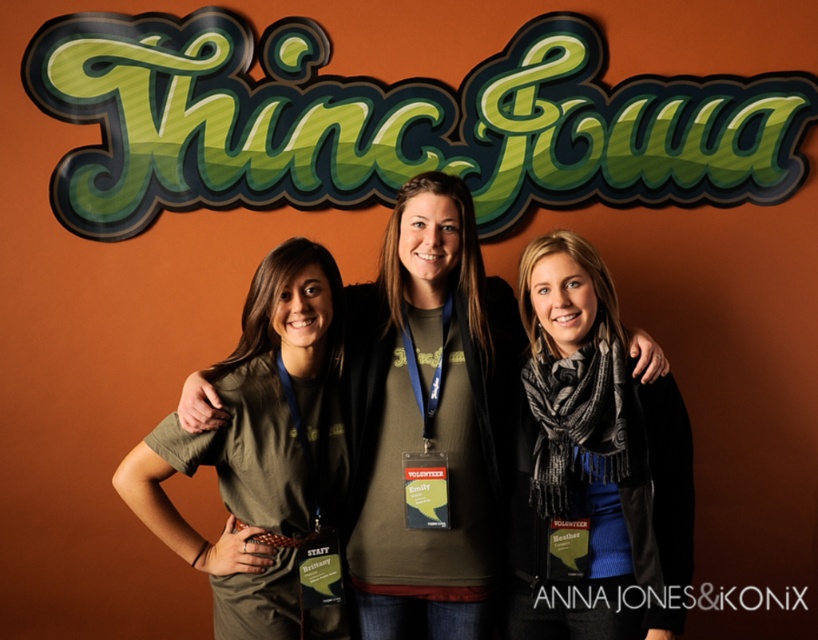
Question: Which point appears farthest from the camera in this image?

Choices:
 (A) (612, 630)
 (B) (302, 518)

Answer: (B)

Question: Which point is farther to the camera?

Choices:
 (A) (434, 195)
 (B) (299, 433)
 (C) (576, 556)

Answer: (A)

Question: Is matte olive green t-shirt at center thinner than black textured scarf at center?

Choices:
 (A) no
 (B) yes

Answer: (A)

Question: Which object is positioned farthest from the matte olive green t-shirt at center?

Choices:
 (A) matte olive green shirt at center
 (B) black textured scarf at center

Answer: (A)

Question: Is matte olive green t-shirt at center positioned behind black textured scarf at center?

Choices:
 (A) yes
 (B) no

Answer: (A)

Question: Is black textured scarf at center to the right of matte olive green shirt at center from the viewer's perspective?

Choices:
 (A) no
 (B) yes

Answer: (B)